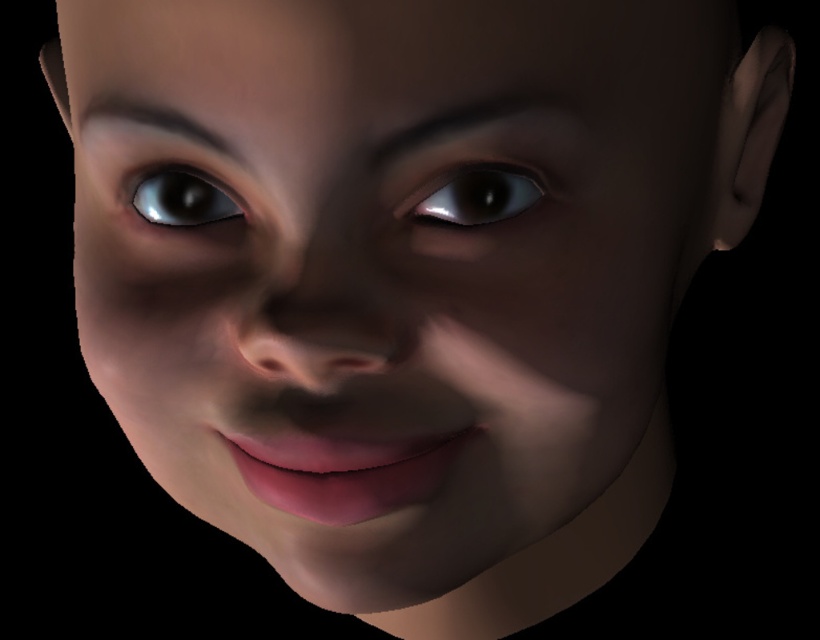
Who is taller, satin silver eye at center or shiny silver eye at center?

With more height is shiny silver eye at center.

Describe the element at coordinates (472, 195) in the screenshot. I see `satin silver eye at center` at that location.

The width and height of the screenshot is (820, 640). What do you see at coordinates (472, 195) in the screenshot? I see `satin silver eye at center` at bounding box center [472, 195].

Find the location of a particular element. Image resolution: width=820 pixels, height=640 pixels. satin silver eye at center is located at coordinates (472, 195).